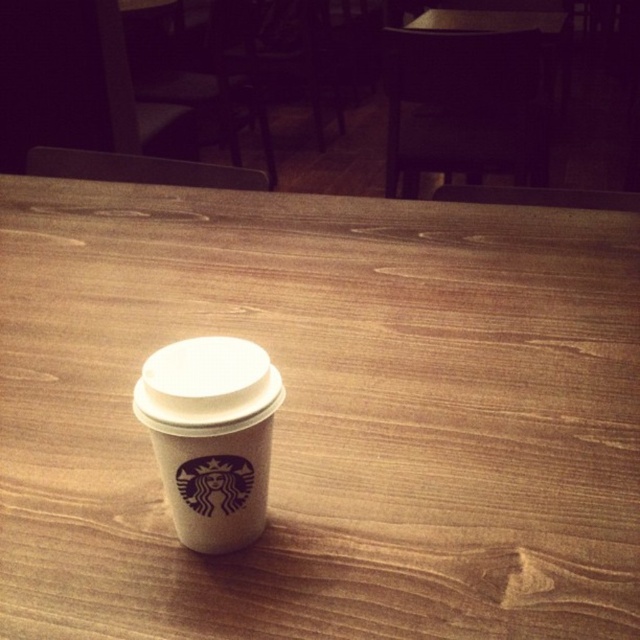
Consider the image. Does wooden table at center have a larger size compared to white paper cup at center?

Correct, wooden table at center is larger in size than white paper cup at center.

Does wooden table at center have a smaller size compared to white paper cup at center?

Incorrect, wooden table at center is not smaller in size than white paper cup at center.

Is point (236, 582) positioned in front of point (228, 483)?

No, it is behind (228, 483).

You are a GUI agent. You are given a task and a screenshot of the screen. Output one action in this format:
    pyautogui.click(x=<x>, y=<y>)
    Task: Click on the wooden table at center
    The height and width of the screenshot is (640, 640).
    Given the screenshot: What is the action you would take?
    pyautogui.click(x=324, y=416)